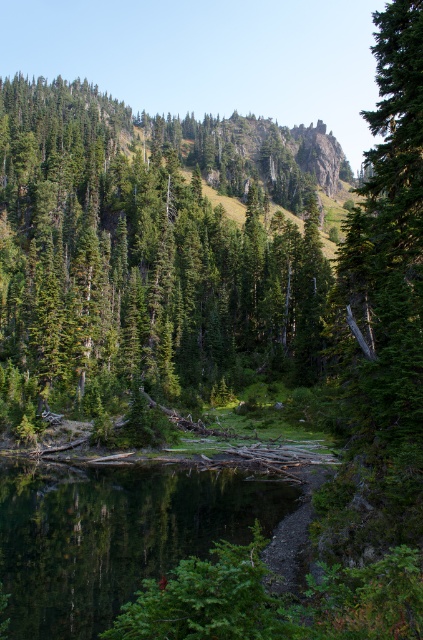
You are standing at the edge of the water and want to walk to the tree. Which direction should you move to reach the green matte tree at center from the smooth reflective water at center?

The green matte tree at center is to the left of the smooth reflective water at center, so you should move to the left to reach it.

You are a photographer aiming to capture the green matte tree at center and the smooth reflective water at center in a single frame. Given that your camera can only focus on one object at a time, which object should you prioritize focusing on to ensure it appears sharp and clear in the photo?

You should prioritize focusing on the green matte tree at center because it is larger in size than the smooth reflective water at center, making it more prominent and likely the main subject of the photo.